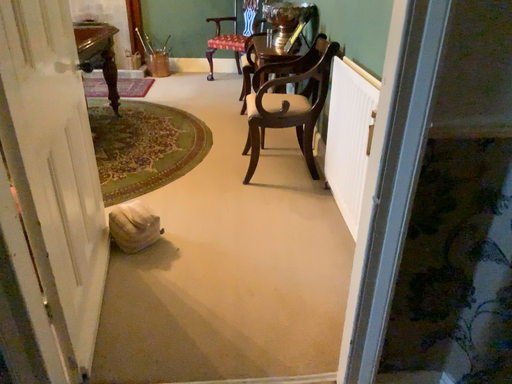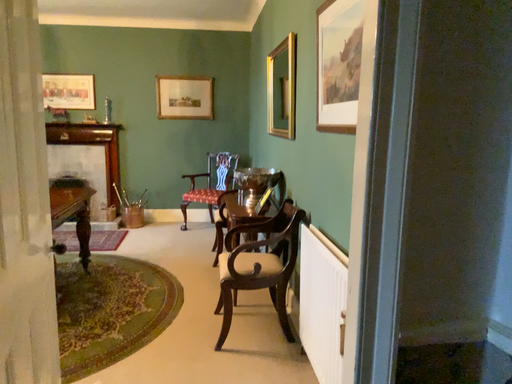
Question: Which way did the camera rotate in the video?

Choices:
 (A) rotated upward
 (B) rotated downward

Answer: (A)